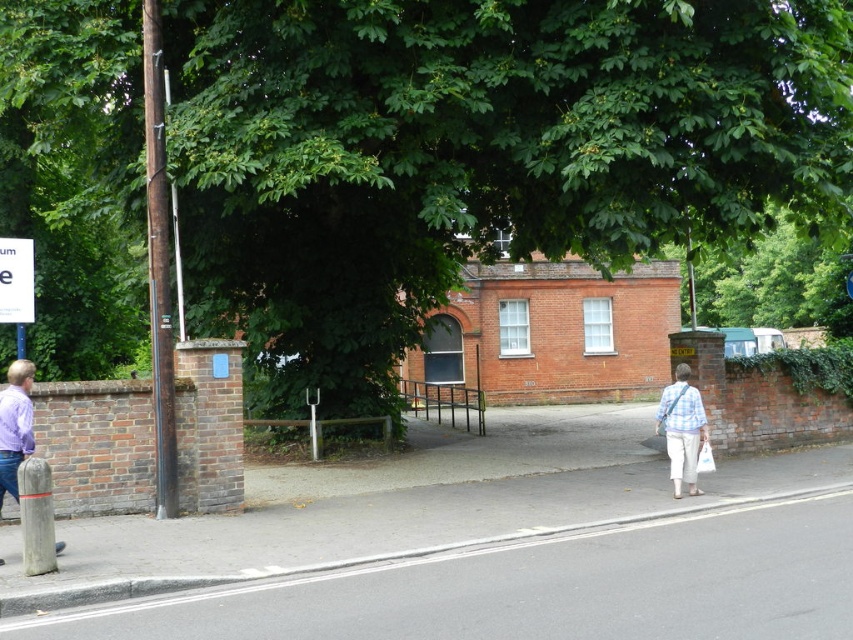
Question: Which object is closer to the camera taking this photo?

Choices:
 (A) plaid shirt and pants at lower right
 (B) white plastic sign at upper left

Answer: (B)

Question: Is the position of gray concrete pavement at lower center more distant than that of plaid shirt and pants at lower right?

Choices:
 (A) yes
 (B) no

Answer: (B)

Question: Which object appears closest to the camera in this image?

Choices:
 (A) plaid shirt and pants at lower right
 (B) purple matte shirt at left
 (C) green leafy tree at upper center
 (D) gray concrete pavement at lower center

Answer: (D)

Question: Which of these objects is positioned closest to the white plastic sign at upper left?

Choices:
 (A) green leafy tree at upper center
 (B) gray concrete pavement at lower center
 (C) plaid shirt and pants at lower right
 (D) purple matte shirt at left

Answer: (D)

Question: Can you confirm if gray concrete pavement at lower center is wider than white plastic sign at upper left?

Choices:
 (A) yes
 (B) no

Answer: (A)

Question: Is green leafy tree at upper center thinner than gray concrete pavement at lower center?

Choices:
 (A) no
 (B) yes

Answer: (A)